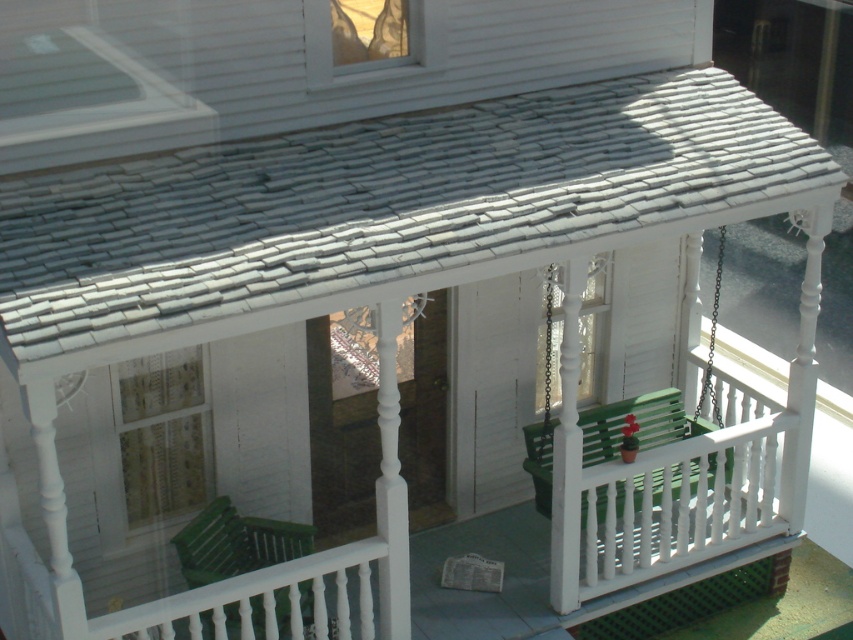
Question: Does white wooden balustrade at center have a smaller size compared to green wooden bench at center?

Choices:
 (A) no
 (B) yes

Answer: (A)

Question: Considering the relative positions of green wooden bench at center and green plastic rocking chair at lower left in the image provided, where is green wooden bench at center located with respect to green plastic rocking chair at lower left?

Choices:
 (A) right
 (B) left

Answer: (A)

Question: Which object appears farthest from the camera in this image?

Choices:
 (A) green plastic rocking chair at lower left
 (B) white wooden balustrade at center
 (C) green wooden bench at center

Answer: (C)

Question: Estimate the real-world distances between objects in this image. Which object is closer to the green wooden bench at center?

Choices:
 (A) green plastic rocking chair at lower left
 (B) white wooden balustrade at center

Answer: (B)

Question: Which point is closer to the camera?

Choices:
 (A) green wooden bench at center
 (B) green plastic rocking chair at lower left
 (C) white wooden balustrade at center

Answer: (B)

Question: Does white wooden balustrade at center appear on the right side of green wooden bench at center?

Choices:
 (A) yes
 (B) no

Answer: (A)